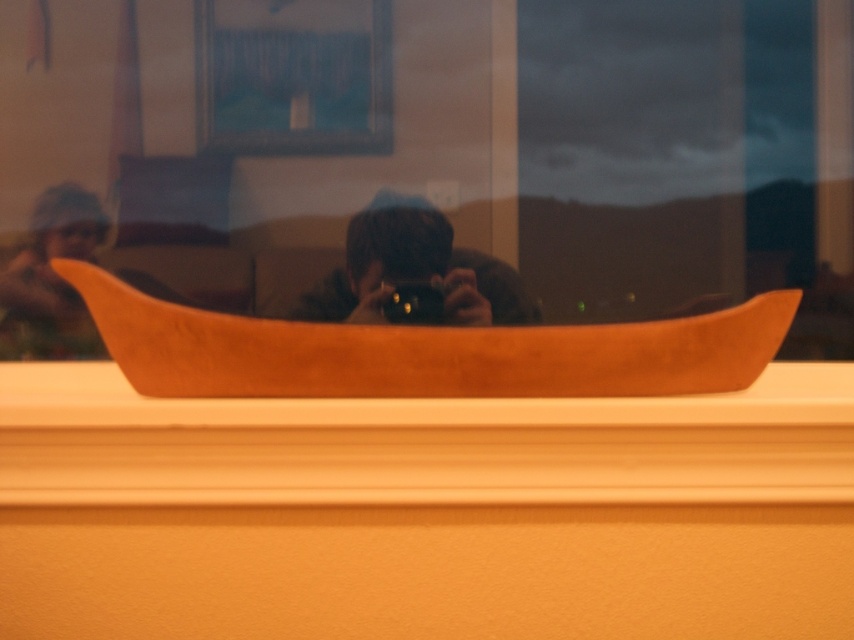
Question: Does smooth wood window sill at lower center come behind matte black camera at center?

Choices:
 (A) yes
 (B) no

Answer: (B)

Question: Which object appears closest to the camera in this image?

Choices:
 (A) transparent glass window at upper center
 (B) smooth wood window sill at lower center

Answer: (B)

Question: Does smooth wood window sill at lower center have a larger size compared to matte black camera at center?

Choices:
 (A) no
 (B) yes

Answer: (B)

Question: Based on their relative distances, which object is nearer to the matte black camera at center?

Choices:
 (A) smooth wood window sill at lower center
 (B) transparent glass window at upper center
 (C) matte brown wooden boat at left

Answer: (B)

Question: Is transparent glass window at upper center wider than smooth wood window sill at lower center?

Choices:
 (A) no
 (B) yes

Answer: (B)

Question: Which point appears farthest from the camera in this image?

Choices:
 (A) (80, 259)
 (B) (26, 477)

Answer: (A)